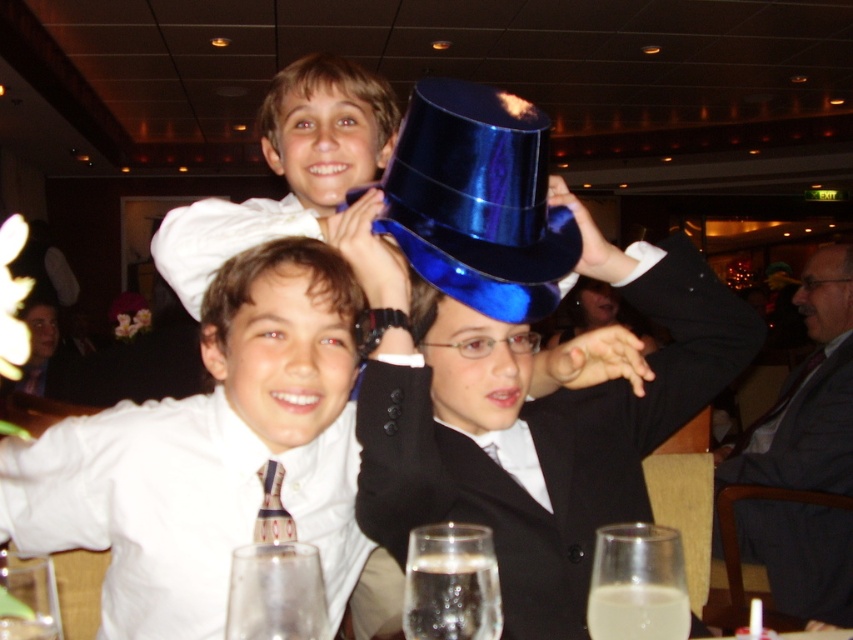
You are a photographer at a formal event and need to arrange two boys wearing matte white shirts in a line for a group photo. The first boy is wearing a matte white shirt at upper center and the second is wearing a matte white shirt at center. From the photographer perspective, which boy should stand to the left of the other?

The matte white shirt at center should stand to the right of the matte white shirt at upper center because the matte white shirt at center is positioned on the right side of matte white shirt at upper center.

You are a photographer setting up for a group photo. You need to ensure that the white satin shirt at center and the gray hair at upper right are both visible in the frame. Given their sizes, which object should you focus on to ensure both are in focus?

The white satin shirt at center is larger than the gray hair at upper right, so focusing on the white satin shirt at center would help ensure both are in focus as it occupies more space in the frame.

You are a photographer standing at the entrance of the banquet hall. You want to take a photo of the white satin shirt at center. Where should you position yourself to capture it in the frame?

The white satin shirt at center is located at coordinates point (210, 452), so you should position yourself facing the center area of the banquet hall to capture it in the frame.